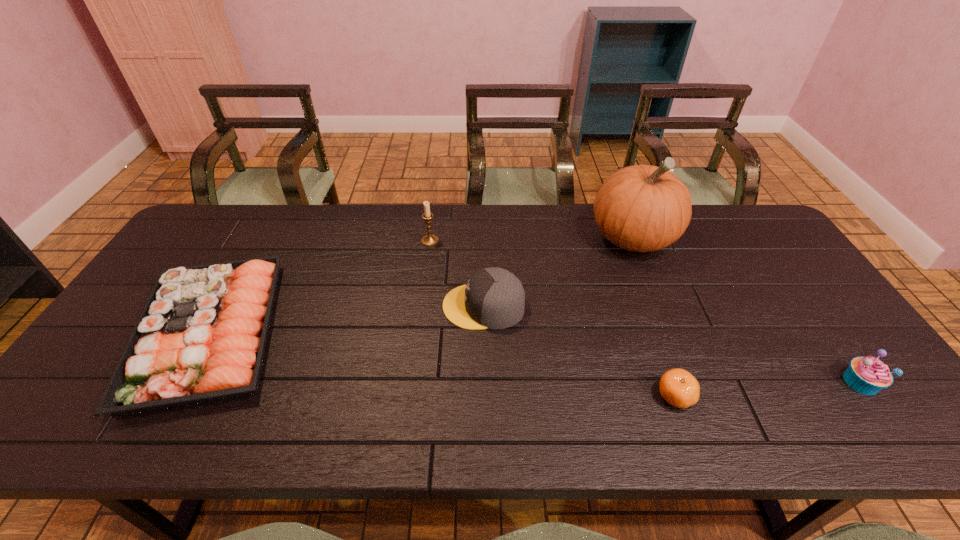
At what (x,y) coordinates should I click in order to perform the action: click on vacant space positioned on the front-facing side of the third object from left to right. Please return your answer as a coordinate pair (x, y). This screenshot has width=960, height=540. Looking at the image, I should click on (356, 306).

This screenshot has width=960, height=540. What are the coordinates of `vacant space located on the front-facing side of the third object from left to right` in the screenshot? It's located at (320, 306).

You are a GUI agent. You are given a task and a screenshot of the screen. Output one action in this format:
    pyautogui.click(x=<x>, y=<y>)
    Task: Click on the vacant space located on the back of the rightmost object
    This screenshot has height=540, width=960.
    Given the screenshot: What is the action you would take?
    click(x=804, y=303)

Identify the location of vacant space located on the left of the clementine. (552, 396).

This screenshot has height=540, width=960. I want to click on free space located 0.390m on the right of the leftmost object, so click(x=438, y=333).

Locate an element on the screen. The image size is (960, 540). pumpkin located at the far edge is located at coordinates (642, 208).

Find the location of a particular element. This screenshot has width=960, height=540. candle holder that is at the far edge is located at coordinates (429, 240).

What are the coordinates of `clementine at the near edge` in the screenshot? It's located at 678,387.

Where is `platter present at the near edge`? The height and width of the screenshot is (540, 960). platter present at the near edge is located at coordinates (201, 337).

Find the location of a particular element. object that is positioned at the left edge is located at coordinates (201, 337).